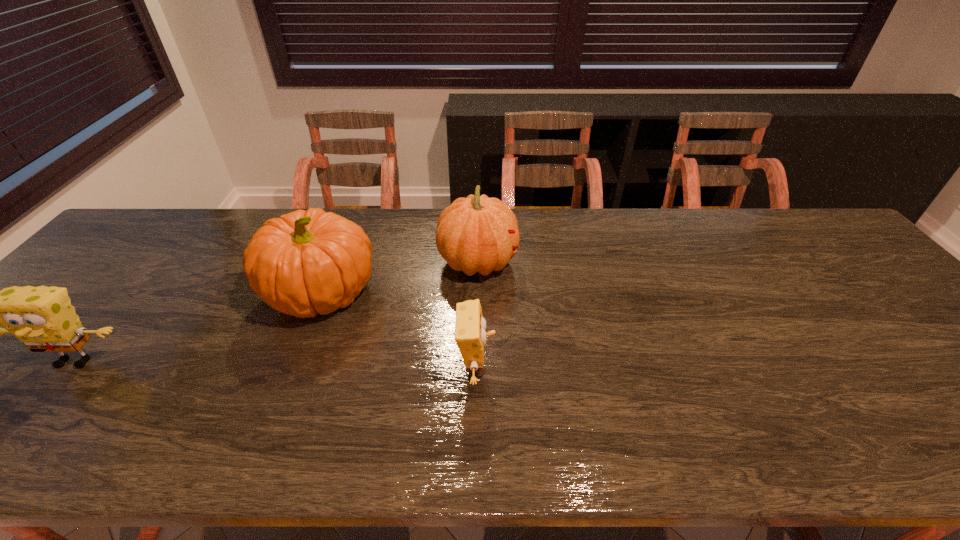
The image size is (960, 540). I want to click on the left pumpkin, so click(x=307, y=262).

In order to click on the right pumpkin in this screenshot , I will do `click(475, 234)`.

The width and height of the screenshot is (960, 540). What are the coordinates of `the leftmost object` in the screenshot? It's located at (43, 318).

At what (x,y) coordinates should I click in order to perform the action: click on the left sponge. Please return your answer as a coordinate pair (x, y). Looking at the image, I should click on (43, 318).

At what (x,y) coordinates should I click in order to perform the action: click on the right sponge. Please return your answer as a coordinate pair (x, y). Looking at the image, I should click on (470, 335).

At what (x,y) coordinates should I click in order to perform the action: click on the shortest object. Please return your answer as a coordinate pair (x, y). Looking at the image, I should click on (470, 335).

The width and height of the screenshot is (960, 540). In order to click on vacant space located on the surface of the third object from right to left in this screenshot , I will do `click(524, 293)`.

You are a GUI agent. You are given a task and a screenshot of the screen. Output one action in this format:
    pyautogui.click(x=<x>, y=<y>)
    Task: Click on the vacant space located 0.180m on the carved face of the right pumpkin
    This screenshot has height=540, width=960.
    Given the screenshot: What is the action you would take?
    pyautogui.click(x=579, y=262)

At what (x,y) coordinates should I click in order to perform the action: click on free space located 0.090m on the face of the leftmost object. Please return your answer as a coordinate pair (x, y). Looking at the image, I should click on (30, 415).

In order to click on vacant area situated on the face of the shorter sponge in this screenshot , I will do (x=539, y=368).